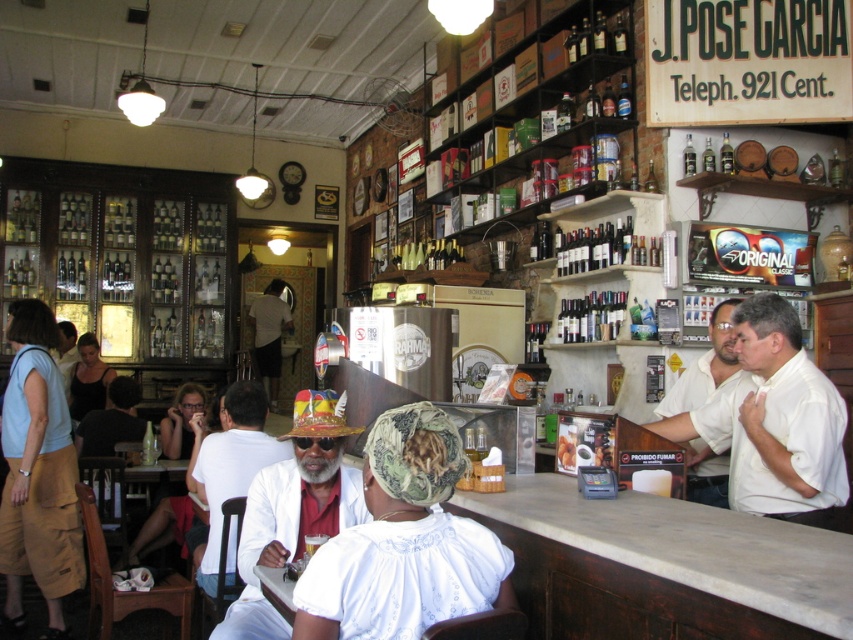
Question: Which is nearer to the matte black hair at center?

Choices:
 (A) white shirt at bar
 (B) white shirt at center
 (C) dark gray shirt at center
 (D) white matte hat at center

Answer: (B)

Question: Which point is farther to the camera?

Choices:
 (A) (19, 609)
 (B) (202, 420)

Answer: (B)

Question: Can you confirm if white shirt at right is positioned below matte black hair at center?

Choices:
 (A) no
 (B) yes

Answer: (A)

Question: Can you confirm if white shirt at right is positioned to the left of dark gray shirt at center?

Choices:
 (A) yes
 (B) no

Answer: (B)

Question: Which point is closer to the camera?

Choices:
 (A) (276, 324)
 (B) (184, 404)

Answer: (B)

Question: Can you confirm if white shirt at center is positioned below white shirt at right?

Choices:
 (A) no
 (B) yes

Answer: (B)